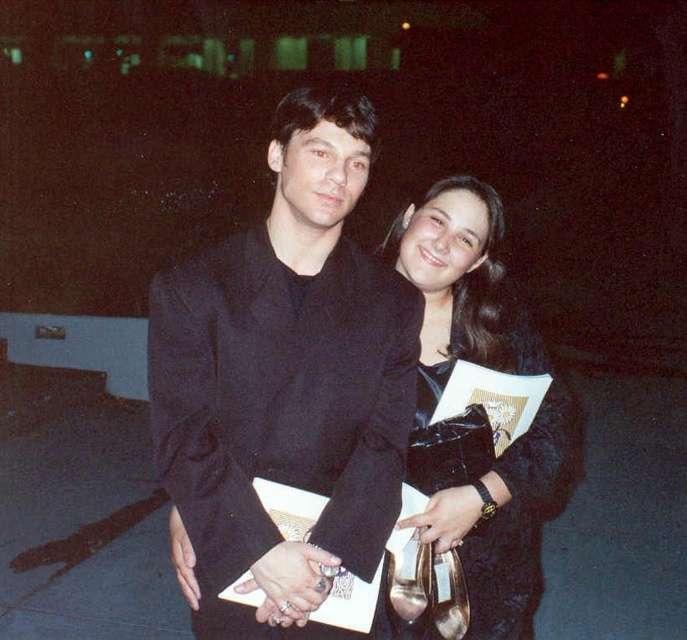
You are a photographer setting up a night shoot in a dimly lit area. You have two subjects wearing the black matte suit at center and holding the black satin clutch at center. To ensure both are visible in the photo, which object should you focus on first?

The black matte suit at center is in front of the black satin clutch at center, so you should focus on the black matte suit at center first to ensure it is clearly visible.

You are a photographer trying to capture a closeup of both the black matte suit at center and the black satin clutch at center in the image. Since the camera can only focus on one object at a time, which object should you choose to ensure it appears larger in the photo?

The black satin clutch at center is wider than the black matte suit at center, so to make it appear larger in the photo, you should focus on the black satin clutch at center.

You are a photographer trying to capture a closeup of the black satin clutch at center without including the black matte suit at center in the frame. Based on their positions, is this possible?

The black matte suit at center is located above the black satin clutch at center, so if you position your camera to focus on the lower part of the black satin clutch at center and ensure the angle does not include the area above it, it should be possible to capture the clutch without the suit in the frame.